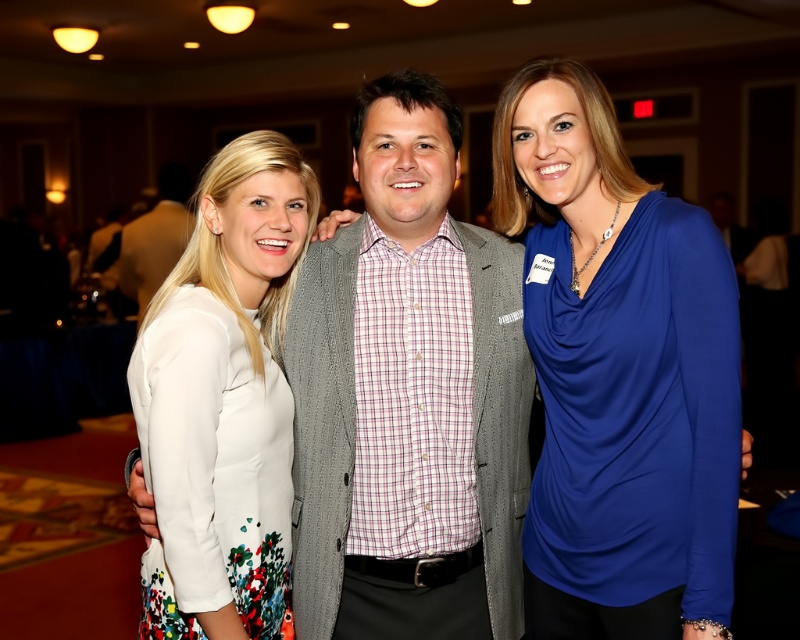
You are a photographer at the event and want to ensure both the blue satin blouse at center and the white floral dress at center are visible in your photo. Which clothing item should you focus on first to capture both?

The blue satin blouse at center is located above the white floral dress at center, so focusing on the blue satin blouse at center first will allow you to frame the shot to include both items.